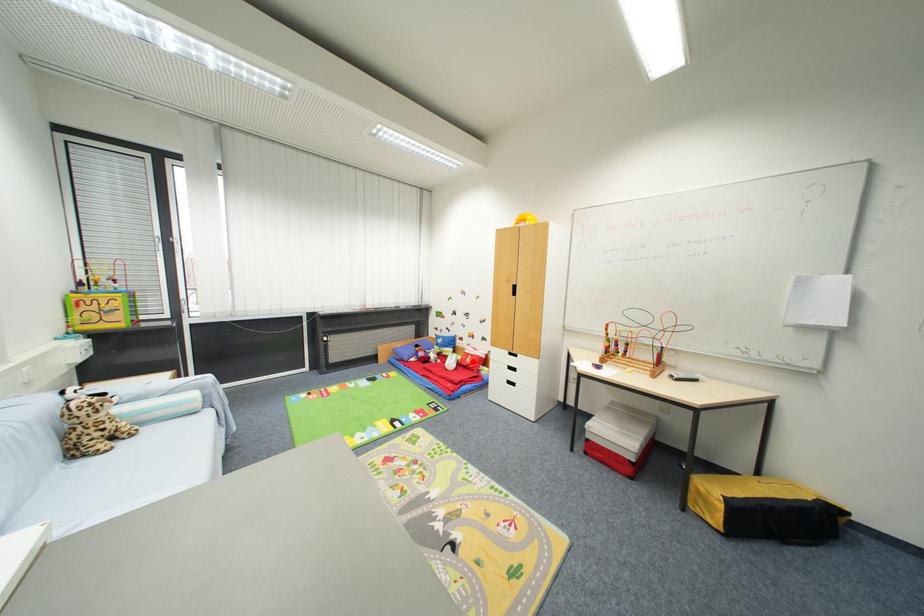
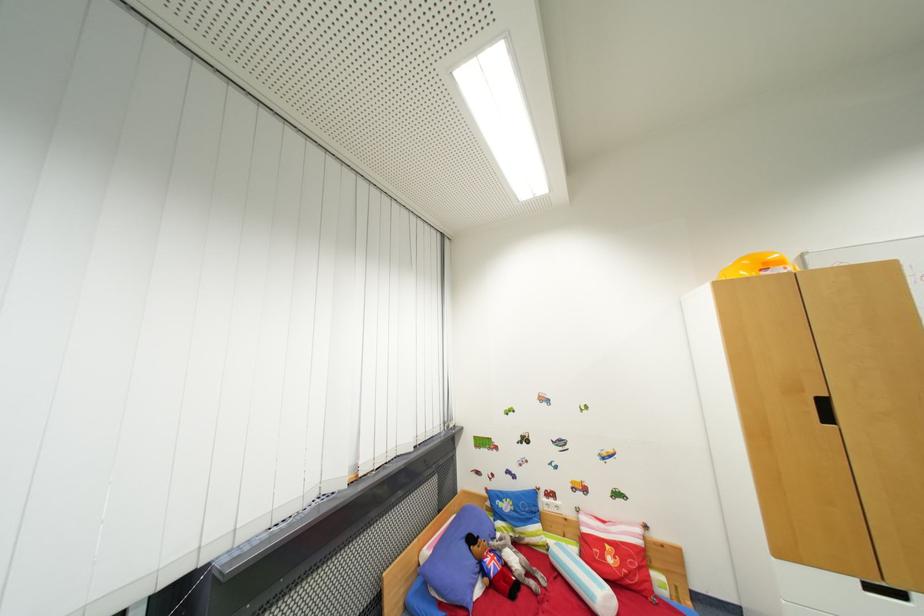
Question: I am providing you with two images of the same scene from different viewpoints. Image1 has a red point marked. In image2, the corresponding 3D location appears at what relative position? Reply with the corresponding letter.

Choices:
 (A) Closer
 (B) Farther

Answer: (A)